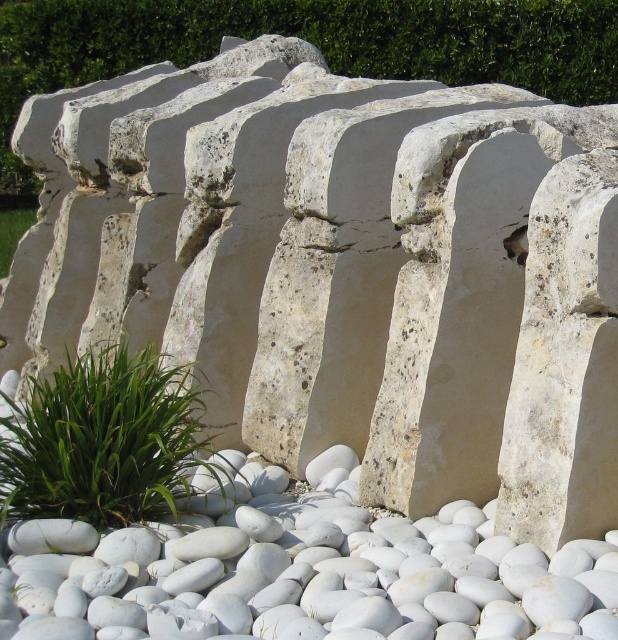
Does white smooth pebble at center appear under green leafy grass at lower left?

Indeed, white smooth pebble at center is positioned under green leafy grass at lower left.

Consider the image. Can you confirm if white smooth pebble at center is wider than green leafy grass at lower left?

Yes, white smooth pebble at center is wider than green leafy grass at lower left.

This screenshot has height=640, width=618. I want to click on white smooth pebble at center, so click(x=302, y=572).

Looking at this image, does white smooth pebble at center appear under green leafy plant at lower left?

Yes.

Is white smooth pebble at center smaller than green leafy plant at lower left?

Yes.

Locate an element on the screen. white smooth pebble at center is located at coordinates pos(302,572).

Does green leafy plant at lower left have a greater width compared to green leafy grass at lower left?

Yes, green leafy plant at lower left is wider than green leafy grass at lower left.

Who is positioned more to the right, green leafy plant at lower left or green leafy grass at lower left?

From the viewer's perspective, green leafy plant at lower left appears more on the right side.

You are a GUI agent. You are given a task and a screenshot of the screen. Output one action in this format:
    pyautogui.click(x=<x>, y=<y>)
    Task: Click on the green leafy plant at lower left
    This screenshot has height=640, width=618.
    Given the screenshot: What is the action you would take?
    click(x=103, y=440)